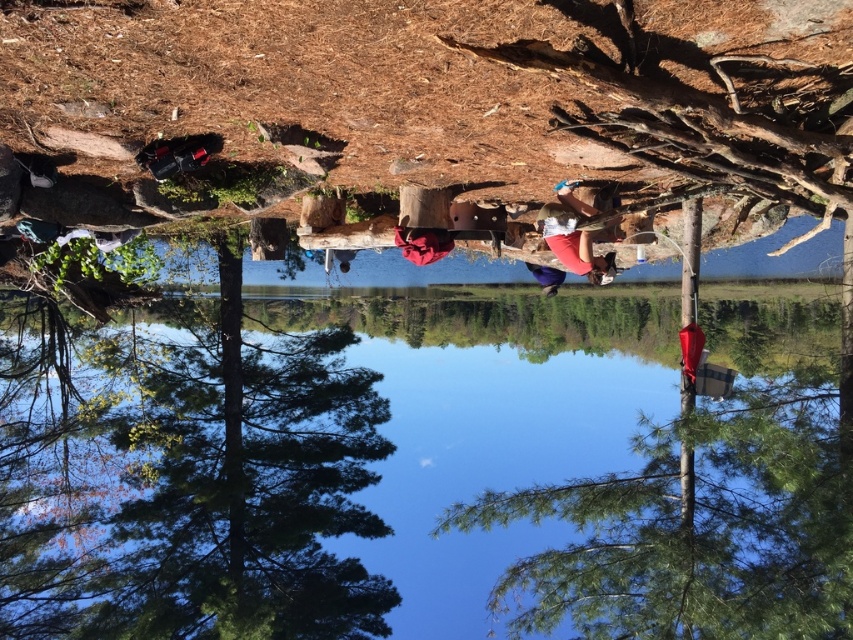
Does green leafy tree at center appear over matte red shorts at center?

Actually, green leafy tree at center is below matte red shorts at center.

Is green leafy tree at center shorter than matte red shorts at center?

Incorrect, green leafy tree at center's height does not fall short of matte red shorts at center's.

Who is more distant from viewer, (674, 573) or (601, 278)?

Positioned behind is point (674, 573).

Where is `green leafy tree at center`? The image size is (853, 640). green leafy tree at center is located at coordinates (698, 529).

Between point (387, 307) and point (601, 276), which one is positioned in front?

Positioned in front is point (601, 276).

Does transparent water at center appear over matte red shorts at center?

No, transparent water at center is not above matte red shorts at center.

The image size is (853, 640). Identify the location of transparent water at center. (341, 456).

Looking at this image, who is positioned more to the left, transparent water at center or green leafy tree at center?

transparent water at center is more to the left.

Between transparent water at center and green leafy tree at center, which one appears on the right side from the viewer's perspective?

green leafy tree at center is more to the right.

This screenshot has width=853, height=640. Find the location of `transparent water at center`. transparent water at center is located at coordinates (341, 456).

Where is `transparent water at center`? The width and height of the screenshot is (853, 640). transparent water at center is located at coordinates (341, 456).